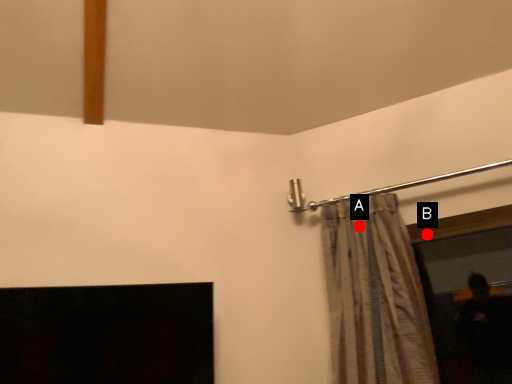
Question: Two points are circled on the image, labeled by A and B beside each circle. Which of the following is the closest to the observer?

Choices:
 (A) A is closer
 (B) B is closer

Answer: (A)